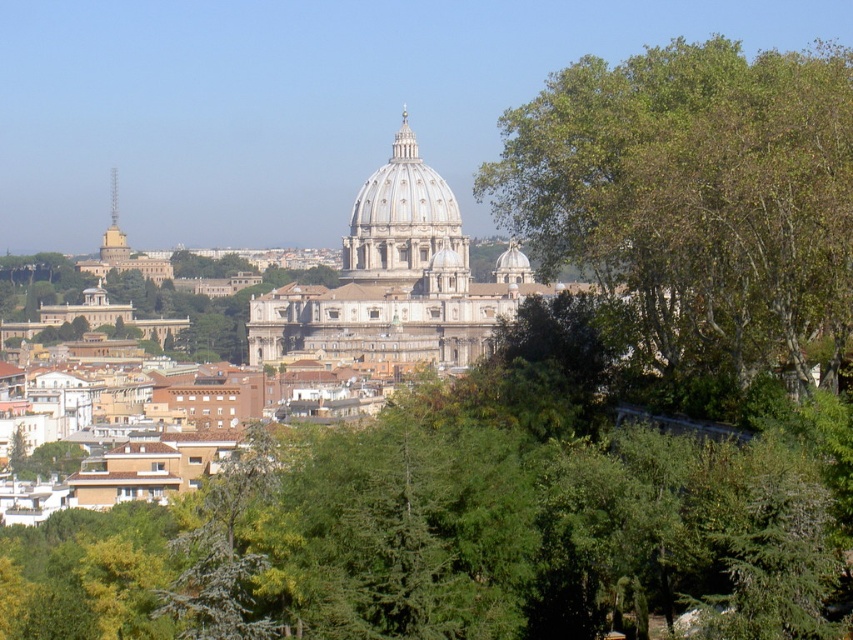
Is green leafy tree at upper right bigger than white marble dome at center?

Yes.

What do you see at coordinates (695, 196) in the screenshot?
I see `green leafy tree at upper right` at bounding box center [695, 196].

Who is more distant from viewer, [805,268] or [373,221]?

Point [373,221]

In order to click on green leafy tree at upper right in this screenshot , I will do `click(695, 196)`.

Is green leafy tree at center shorter than white marble dome at center?

No.

Is point (207, 573) closer to viewer compared to point (457, 280)?

Yes, it is in front of point (457, 280).

The width and height of the screenshot is (853, 640). In order to click on green leafy tree at center in this screenshot , I will do `click(474, 516)`.

How much distance is there between green leafy tree at center and green leafy tree at upper right?

24.77 meters

Based on the photo, which of these two, green leafy tree at center or green leafy tree at upper right, stands taller?

Standing taller between the two is green leafy tree at upper right.

Who is more forward, [784,614] or [845,97]?

Positioned in front is point [784,614].

At what (x,y) coordinates should I click in order to perform the action: click on green leafy tree at center. Please return your answer as a coordinate pair (x, y). The height and width of the screenshot is (640, 853). Looking at the image, I should click on (474, 516).